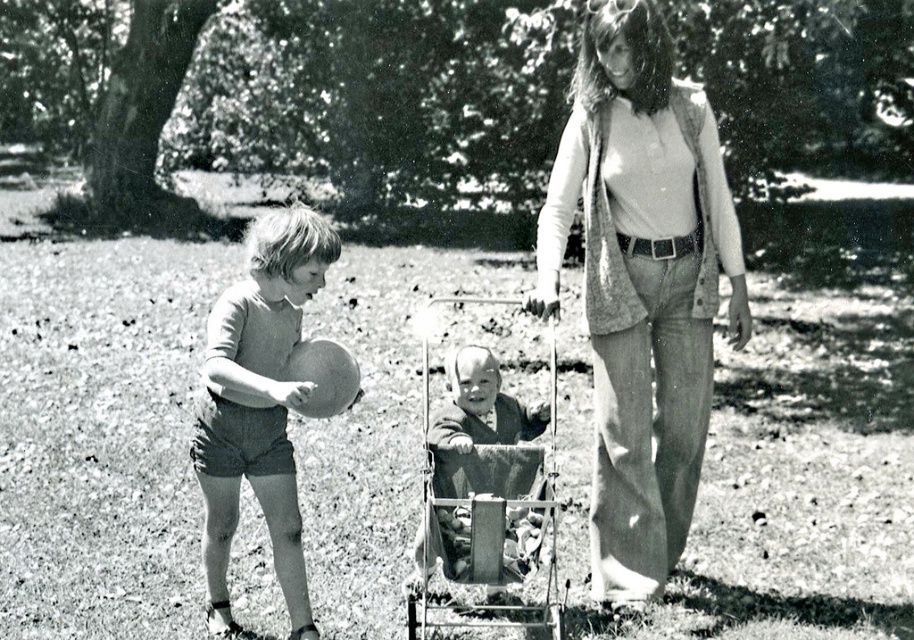
Question: Which point appears closest to the camera in this image?

Choices:
 (A) (641, 371)
 (B) (301, 314)

Answer: (A)

Question: In this image, where is smooth beige shorts at left located relative to metallic silver baby carriage at center?

Choices:
 (A) left
 (B) right

Answer: (A)

Question: Which of the following is the closest to the observer?

Choices:
 (A) smooth beige shorts at left
 (B) knitted sweater at center
 (C) metallic silver baby carriage at center

Answer: (A)

Question: Is smooth beige shorts at left wider than metallic silver baby carriage at center?

Choices:
 (A) yes
 (B) no

Answer: (A)

Question: Among these points, which one is farthest from the camera?

Choices:
 (A) (466, 625)
 (B) (274, 321)
 (C) (652, 442)

Answer: (C)

Question: Is knitted sweater at center above metallic silver baby carriage at center?

Choices:
 (A) no
 (B) yes

Answer: (B)